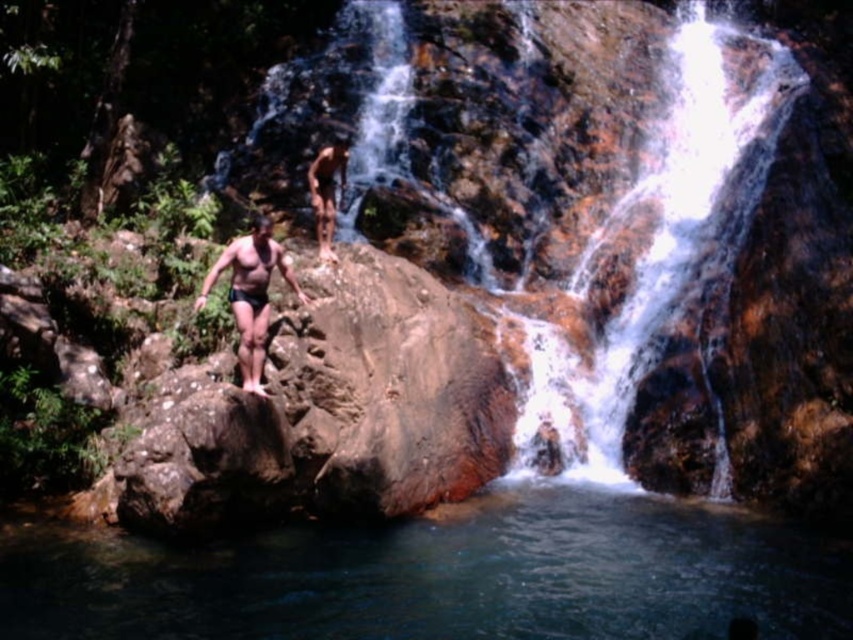
Is point (817, 564) positioned after point (282, 269)?

No, (817, 564) is in front of (282, 269).

You are a GUI agent. You are given a task and a screenshot of the screen. Output one action in this format:
    pyautogui.click(x=<x>, y=<y>)
    Task: Click on the clear blue water at center
    This screenshot has height=640, width=853.
    Given the screenshot: What is the action you would take?
    pyautogui.click(x=442, y=577)

Can you confirm if translucent wet rock at center is shorter than smooth skin man at center?

No, translucent wet rock at center is not shorter than smooth skin man at center.

Does translucent wet rock at center come in front of smooth skin man at center?

No, it is behind smooth skin man at center.

Image resolution: width=853 pixels, height=640 pixels. Find the location of `translucent wet rock at center`. translucent wet rock at center is located at coordinates (654, 248).

Between clear blue water at center and translucent wet rock at center, which one appears on the right side from the viewer's perspective?

translucent wet rock at center is more to the right.

Between clear blue water at center and translucent wet rock at center, which one appears on the left side from the viewer's perspective?

From the viewer's perspective, clear blue water at center appears more on the left side.

Between point (206, 579) and point (614, 390), which one is positioned in front?

Point (206, 579) is in front.

Identify the location of clear blue water at center. This screenshot has width=853, height=640. (442, 577).